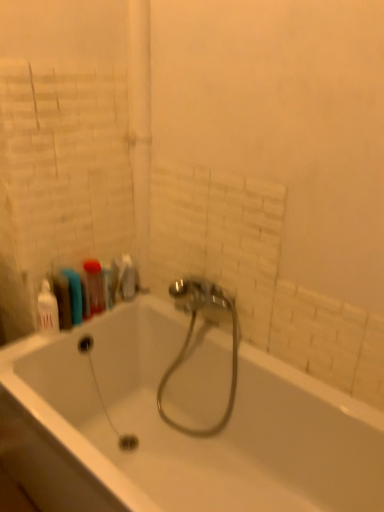
You are a GUI agent. You are given a task and a screenshot of the screen. Output one action in this format:
    pyautogui.click(x=<x>, y=<y>)
    Task: Click on the translucent plastic bottle at left
    This screenshot has height=512, width=384.
    Given the screenshot: What is the action you would take?
    pyautogui.click(x=94, y=286)

From the picture: What is the approximate width of white glossy bathtub at center?

It is 29.82 inches.

In order to click on translucent plastic bottle at left in this screenshot , I will do `click(94, 286)`.

Which is in front, white glossy bathtub at center or translucent plastic bottle at left?

white glossy bathtub at center is closer to the camera.

Where is `bathtub located in front of the translucent plastic bottle at left`? The width and height of the screenshot is (384, 512). bathtub located in front of the translucent plastic bottle at left is located at coordinates (178, 432).

Is white glossy bathtub at center not close to translucent plastic bottle at left?

white glossy bathtub at center is actually quite close to translucent plastic bottle at left.

Does white glossy bathtub at center have a greater height compared to translucent plastic bottle at left?

Yes.

Measure the distance from translucent plastic toothbrush at upper left, marked as the 2th toiletry in a left-to-right arrangement, to white glossy bathtub at center.

translucent plastic toothbrush at upper left, marked as the 2th toiletry in a left-to-right arrangement, is 21.58 inches away from white glossy bathtub at center.

Where is `bathtub in front of the translucent plastic toothbrush at upper left, acting as the 2th toiletry starting from the front`? This screenshot has width=384, height=512. bathtub in front of the translucent plastic toothbrush at upper left, acting as the 2th toiletry starting from the front is located at coordinates (178, 432).

Can you confirm if translucent plastic toothbrush at upper left, which is the 1th toiletry in back-to-front order, is thinner than white glossy bathtub at center?

Yes.

From a real-world perspective, is translucent plastic toothbrush at upper left, which is the 1th toiletry in back-to-front order, physically above white glossy bathtub at center?

Yes, from a real-world perspective, translucent plastic toothbrush at upper left, which is the 1th toiletry in back-to-front order, is on top of white glossy bathtub at center.

Considering the sizes of objects white glossy bathtub at center and white glossy bottle at left, the 2th toiletry from the back, in the image provided, who is wider, white glossy bathtub at center or white glossy bottle at left, the 2th toiletry from the back,?

With larger width is white glossy bathtub at center.

Is white glossy bathtub at center facing away from white glossy bottle at left, the second toiletry from the right?

That's not correct — white glossy bathtub at center is not looking away from white glossy bottle at left, the second toiletry from the right.

In the scene shown: Which is more to the left, white glossy bathtub at center or white glossy bottle at left, acting as the first toiletry starting from the front?

Positioned to the left is white glossy bottle at left, acting as the first toiletry starting from the front.

Is translucent plastic toothbrush at upper left, marked as the 2th toiletry in a left-to-right arrangement, thinner than shiny chrome faucet at center?

Indeed, translucent plastic toothbrush at upper left, marked as the 2th toiletry in a left-to-right arrangement, has a lesser width compared to shiny chrome faucet at center.

Considering the positions of objects translucent plastic toothbrush at upper left, acting as the first toiletry starting from the right, and shiny chrome faucet at center in the image provided, who is behind, translucent plastic toothbrush at upper left, acting as the first toiletry starting from the right, or shiny chrome faucet at center?

translucent plastic toothbrush at upper left, acting as the first toiletry starting from the right, is further away from the camera.

Is shiny chrome faucet at center a part of translucent plastic toothbrush at upper left, acting as the 2th toiletry starting from the front?

No, translucent plastic toothbrush at upper left, acting as the 2th toiletry starting from the front, does not contain shiny chrome faucet at center.

Considering the sizes of translucent plastic toothbrush at upper left, acting as the first toiletry starting from the right, and shiny chrome faucet at center in the image, is translucent plastic toothbrush at upper left, acting as the first toiletry starting from the right, bigger or smaller than shiny chrome faucet at center?

Clearly, translucent plastic toothbrush at upper left, acting as the first toiletry starting from the right, is smaller in size than shiny chrome faucet at center.

Is translucent plastic bottle at left shorter than translucent plastic toothbrush at upper left, marked as the 2th toiletry in a left-to-right arrangement?

No.

Between translucent plastic bottle at left and translucent plastic toothbrush at upper left, marked as the 2th toiletry in a left-to-right arrangement, which one is positioned behind?

translucent plastic toothbrush at upper left, marked as the 2th toiletry in a left-to-right arrangement, is further away from the camera.

From the image's perspective, would you say translucent plastic bottle at left is positioned over translucent plastic toothbrush at upper left, acting as the 2th toiletry starting from the front?

Correct, translucent plastic bottle at left appears higher than translucent plastic toothbrush at upper left, acting as the 2th toiletry starting from the front, in the image.

Is white glossy bottle at left, the second toiletry from the right, thinner than shiny chrome faucet at center?

Yes.

Looking at this image, from the image's perspective, is white glossy bottle at left, acting as the first toiletry starting from the front, on top of shiny chrome faucet at center?

Yes.

Would you say white glossy bottle at left, acting as the first toiletry starting from the front, is outside shiny chrome faucet at center?

Yes, white glossy bottle at left, acting as the first toiletry starting from the front, is not within shiny chrome faucet at center.

Which is closer to the camera, (48, 314) or (95, 302)?

Clearly, point (48, 314) is closer to the camera than point (95, 302).

Who is more distant, white glossy bottle at left, the 2th toiletry from the back, or translucent plastic bottle at left?

translucent plastic bottle at left is further from the camera.

Does white glossy bottle at left, the 2th toiletry from the back, have a lesser width compared to translucent plastic bottle at left?

Yes.

Is white glossy bottle at left, acting as the first toiletry starting from the front, turned away from translucent plastic bottle at left?

white glossy bottle at left, acting as the first toiletry starting from the front, does not have its back to translucent plastic bottle at left.

Identify the location of bathtub below the translucent plastic bottle at left (from a real-world perspective). (178, 432).

Where is `the 2nd toiletry behind the white glossy bathtub at center, counting from the anchor's position`? This screenshot has width=384, height=512. the 2nd toiletry behind the white glossy bathtub at center, counting from the anchor's position is located at coordinates (x=108, y=287).

Based on their spatial positions, is translucent plastic toothbrush at upper left, marked as the 2th toiletry in a left-to-right arrangement, or white glossy bottle at left, the first toiletry in the left-to-right sequence, closer to shiny chrome faucet at center?

Based on the image, translucent plastic toothbrush at upper left, marked as the 2th toiletry in a left-to-right arrangement, appears to be nearer to shiny chrome faucet at center.

From the image, which object appears to be nearer to shiny chrome faucet at center, translucent plastic bottle at left or translucent plastic toothbrush at upper left, which is the 1th toiletry in back-to-front order?

translucent plastic bottle at left.

Which object lies nearer to the anchor point translucent plastic bottle at left, white glossy bathtub at center or white glossy bottle at left, the second toiletry from the right?

white glossy bottle at left, the second toiletry from the right, is positioned closer to the anchor translucent plastic bottle at left.

Considering their positions, is white glossy bottle at left, the first toiletry in the left-to-right sequence, positioned further to shiny chrome faucet at center than translucent plastic toothbrush at upper left, marked as the 2th toiletry in a left-to-right arrangement?

white glossy bottle at left, the first toiletry in the left-to-right sequence.

When comparing their distances from translucent plastic toothbrush at upper left, marked as the 2th toiletry in a left-to-right arrangement, does translucent plastic bottle at left or shiny chrome faucet at center seem further?

shiny chrome faucet at center lies further to translucent plastic toothbrush at upper left, marked as the 2th toiletry in a left-to-right arrangement, than the other object.

Based on their spatial positions, is white glossy bathtub at center or translucent plastic toothbrush at upper left, acting as the first toiletry starting from the right, closer to translucent plastic bottle at left?

translucent plastic toothbrush at upper left, acting as the first toiletry starting from the right, is closer to translucent plastic bottle at left.

Looking at the image, which one is located further to white glossy bottle at left, the first toiletry in the left-to-right sequence, translucent plastic toothbrush at upper left, marked as the 2th toiletry in a left-to-right arrangement, or shiny chrome faucet at center?

shiny chrome faucet at center lies further to white glossy bottle at left, the first toiletry in the left-to-right sequence, than the other object.

From the image, which object appears to be nearer to white glossy bottle at left, the second toiletry from the right, translucent plastic toothbrush at upper left, acting as the first toiletry starting from the right, or translucent plastic bottle at left?

translucent plastic bottle at left.

Where is `toiletry between translucent plastic bottle at left and shiny chrome faucet at center from left to right`? The width and height of the screenshot is (384, 512). toiletry between translucent plastic bottle at left and shiny chrome faucet at center from left to right is located at coordinates pyautogui.click(x=108, y=287).

Identify the location of toiletry between white glossy bathtub at center and translucent plastic toothbrush at upper left, acting as the 2th toiletry starting from the front, along the z-axis. The image size is (384, 512). (47, 309).

Where is `cleaning product located between white glossy bottle at left, the 2th toiletry from the back, and translucent plastic toothbrush at upper left, acting as the first toiletry starting from the right, in the depth direction`? This screenshot has height=512, width=384. cleaning product located between white glossy bottle at left, the 2th toiletry from the back, and translucent plastic toothbrush at upper left, acting as the first toiletry starting from the right, in the depth direction is located at coordinates (94, 286).

You are a GUI agent. You are given a task and a screenshot of the screen. Output one action in this format:
    pyautogui.click(x=<x>, y=<y>)
    Task: Click on the toiletry between white glossy bottle at left, the first toiletry in the left-to-right sequence, and shiny chrome faucet at center, in the horizontal direction
    This screenshot has width=384, height=512.
    Given the screenshot: What is the action you would take?
    pyautogui.click(x=108, y=287)